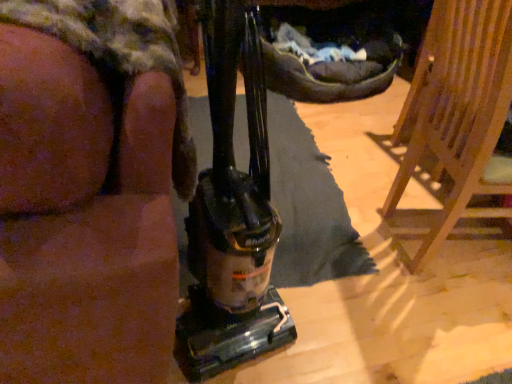
Question: Is point (139, 107) positioned closer to the camera than point (433, 66)?

Choices:
 (A) closer
 (B) farther

Answer: (A)

Question: Is brown fabric couch at left inside the boundaries of wooden chair at right, or outside?

Choices:
 (A) inside
 (B) outside

Answer: (B)

Question: In terms of size, does brown fabric couch at left appear bigger or smaller than wooden chair at right?

Choices:
 (A) small
 (B) big

Answer: (B)

Question: From the image's perspective, is wooden chair at right positioned above or below brown fabric couch at left?

Choices:
 (A) below
 (B) above

Answer: (A)

Question: Visually, is wooden chair at right positioned to the left or to the right of brown fabric couch at left?

Choices:
 (A) left
 (B) right

Answer: (B)

Question: From a real-world perspective, is wooden chair at right above or below brown fabric couch at left?

Choices:
 (A) above
 (B) below

Answer: (B)

Question: From their relative heights in the image, would you say wooden chair at right is taller or shorter than brown fabric couch at left?

Choices:
 (A) short
 (B) tall

Answer: (A)